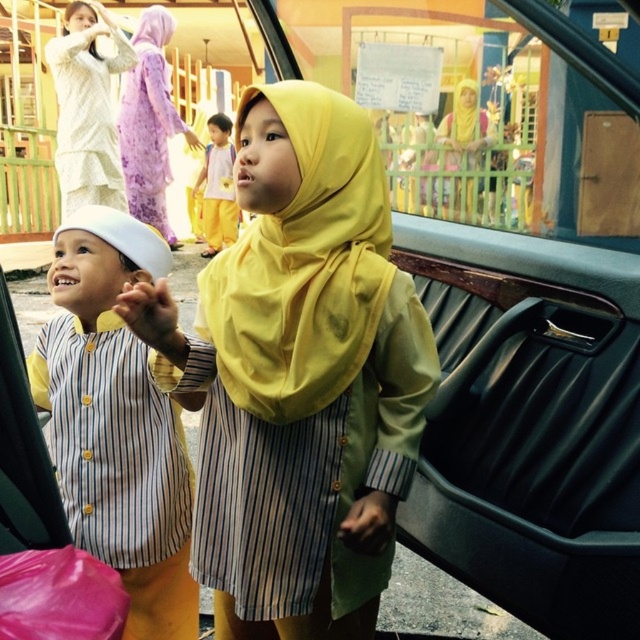
Question: From the image, what is the correct spatial relationship of yellow matte hijab at center in relation to white lace dress at upper left?

Choices:
 (A) below
 (B) above

Answer: (A)

Question: Can you confirm if white lace dress at upper left is positioned above light purple floral dress at upper left?

Choices:
 (A) yes
 (B) no

Answer: (B)

Question: Which point is closer to the camera?

Choices:
 (A) (228, 214)
 (B) (70, 259)
 (C) (310, 563)

Answer: (C)

Question: Can you confirm if yellow matte hijab at center is positioned below light purple floral dress at upper left?

Choices:
 (A) no
 (B) yes

Answer: (B)

Question: Which of the following is the closest to the observer?

Choices:
 (A) (378, 232)
 (B) (557, 328)
 (C) (163, 125)

Answer: (A)

Question: Which of the following is the closest to the observer?

Choices:
 (A) white lace dress at upper left
 (B) matte black car door at lower right
 (C) yellow fabric shirt at center

Answer: (B)